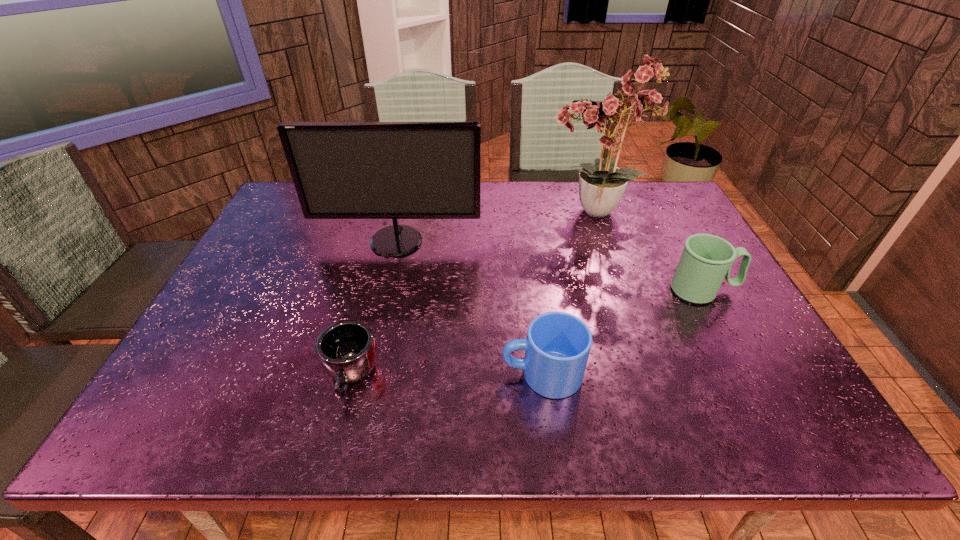
The width and height of the screenshot is (960, 540). What are the coordinates of `free spot that satisfies the following two spatial constraints: 1. on the front-facing side of the tallest object; 2. on the side of the shortest mug with the handle` in the screenshot? It's located at (649, 377).

You are a GUI agent. You are given a task and a screenshot of the screen. Output one action in this format:
    pyautogui.click(x=<x>, y=<y>)
    Task: Click on the vacant region that satisfies the following two spatial constraints: 1. on the side of the second mug from left to right with the handle; 2. on the side of the leftmost mug with the handle
    Image resolution: width=960 pixels, height=540 pixels.
    Given the screenshot: What is the action you would take?
    pyautogui.click(x=542, y=377)